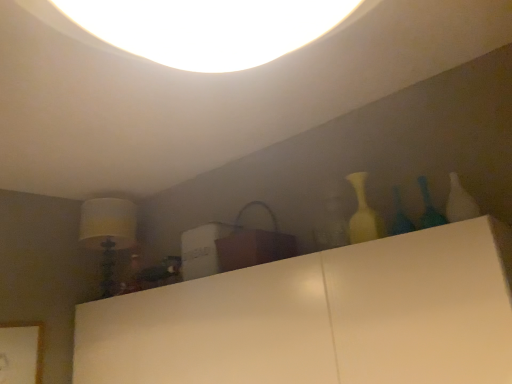
Question: From a real-world perspective, is matte white vase at right positioned over translucent glass vase at upper right, which is the first glass vase in left-to-right order, based on gravity?

Choices:
 (A) yes
 (B) no

Answer: (A)

Question: Can you confirm if matte white vase at right is shorter than translucent glass vase at upper right, which is the first glass vase in left-to-right order?

Choices:
 (A) no
 (B) yes

Answer: (A)

Question: Does matte white vase at right lie in front of translucent glass vase at upper right, marked as the second glass vase in a right-to-left arrangement?

Choices:
 (A) no
 (B) yes

Answer: (A)

Question: Does matte white vase at right have a smaller size compared to translucent glass vase at upper right, marked as the second glass vase in a right-to-left arrangement?

Choices:
 (A) no
 (B) yes

Answer: (A)

Question: From the image's perspective, does matte white vase at right appear lower than translucent glass vase at upper right, which is the first glass vase in left-to-right order?

Choices:
 (A) yes
 (B) no

Answer: (A)

Question: Can you confirm if matte white vase at right is wider than translucent glass vase at upper right, marked as the second glass vase in a right-to-left arrangement?

Choices:
 (A) no
 (B) yes

Answer: (B)

Question: From the image's perspective, is translucent glass vase at right, placed as the 2th glass vase when sorted from left to right, on matte white vase at right?

Choices:
 (A) yes
 (B) no

Answer: (A)

Question: Considering the relative sizes of translucent glass vase at right, placed as the 2th glass vase when sorted from left to right, and matte white vase at right in the image provided, is translucent glass vase at right, placed as the 2th glass vase when sorted from left to right, taller than matte white vase at right?

Choices:
 (A) no
 (B) yes

Answer: (A)

Question: From the image's perspective, would you say translucent glass vase at right, positioned as the 1th glass vase in right-to-left order, is shown under matte white vase at right?

Choices:
 (A) yes
 (B) no

Answer: (B)

Question: Is translucent glass vase at right, placed as the 2th glass vase when sorted from left to right, next to matte white vase at right and touching it?

Choices:
 (A) yes
 (B) no

Answer: (B)

Question: Can you confirm if translucent glass vase at right, placed as the 2th glass vase when sorted from left to right, is shorter than matte white vase at right?

Choices:
 (A) no
 (B) yes

Answer: (B)

Question: Is translucent glass vase at right, positioned as the 1th glass vase in right-to-left order, wider than matte white vase at right?

Choices:
 (A) yes
 (B) no

Answer: (B)

Question: From a real-world perspective, is translucent glass vase at right, positioned as the 1th glass vase in right-to-left order, on translucent glass vase at upper right, which is the first glass vase in left-to-right order?

Choices:
 (A) yes
 (B) no

Answer: (A)